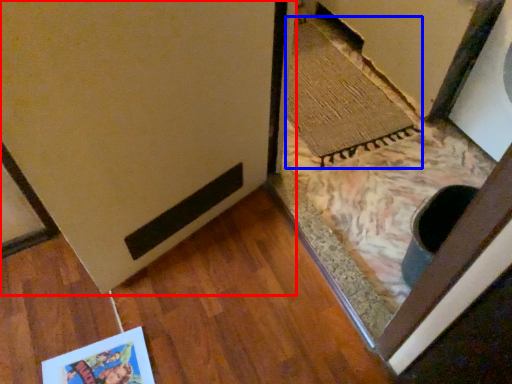
Question: Which object appears farthest to the camera in this image, door (highlighted by a red box) or doormat (highlighted by a blue box)?

Choices:
 (A) door
 (B) doormat

Answer: (B)